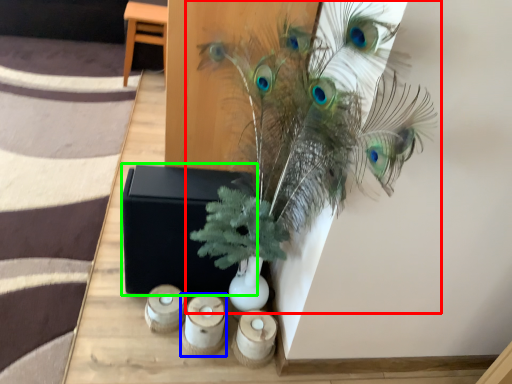
Question: Which object is the farthest from houseplant (highlighted by a red box)? Choose among these: candle holder (highlighted by a blue box) or box (highlighted by a green box).

Choices:
 (A) candle holder
 (B) box

Answer: (A)